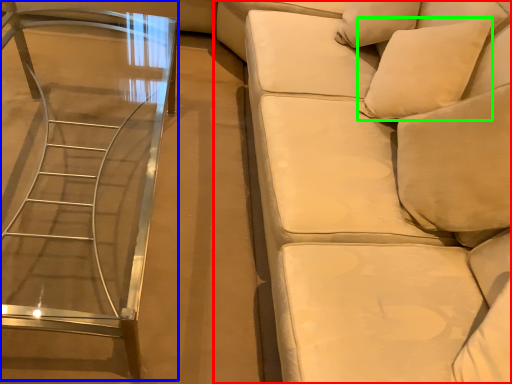
Question: Which object is positioned farthest from studio couch (highlighted by a red box)? Select from table (highlighted by a blue box) and pillow (highlighted by a green box).

Choices:
 (A) table
 (B) pillow

Answer: (A)